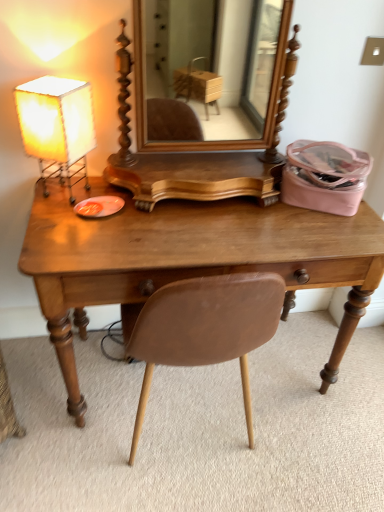
At what (x,y) coordinates should I click in order to perform the action: click on vacant region below wooden desk at center (from a real-world perspective). Please return your answer as a coordinate pair (x, y). Looking at the image, I should click on (216, 370).